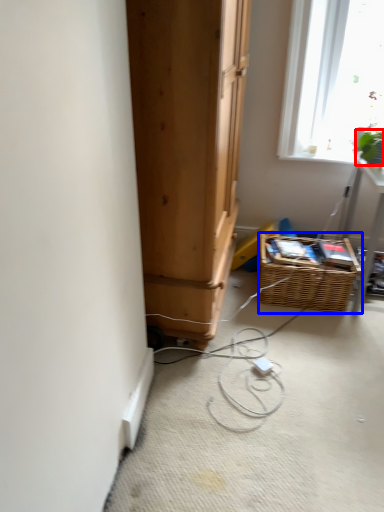
Question: Which point is closer to the camera, plant (highlighted by a red box) or basket (highlighted by a blue box)?

Choices:
 (A) plant
 (B) basket

Answer: (A)